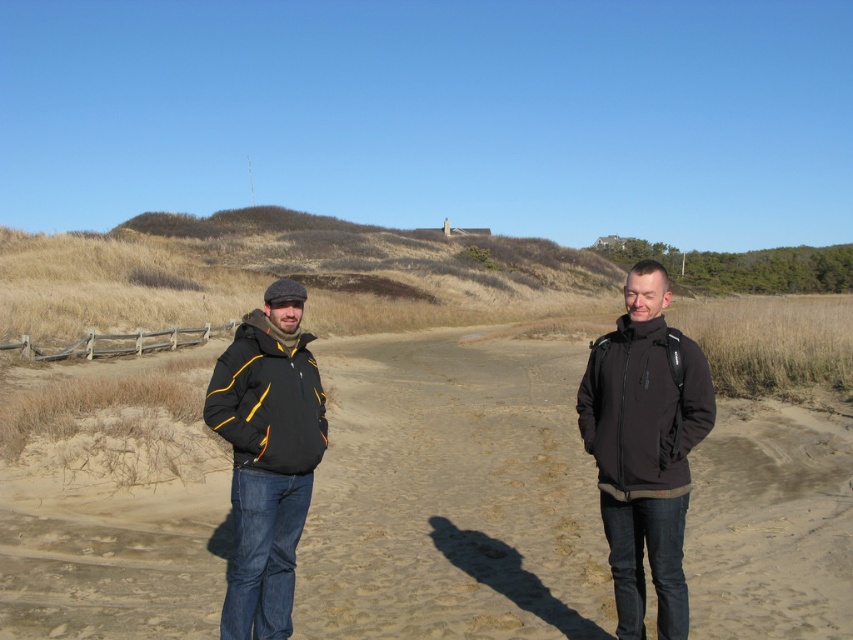
Question: Which of these objects is positioned farthest from the matte black jacket at left?

Choices:
 (A) black softshell jacket at center
 (B) dull brown dirt at center

Answer: (B)

Question: Is dull brown dirt at center smaller than black softshell jacket at center?

Choices:
 (A) no
 (B) yes

Answer: (A)

Question: Can you confirm if black softshell jacket at center is bigger than matte black jacket at left?

Choices:
 (A) yes
 (B) no

Answer: (B)

Question: Among these objects, which one is nearest to the camera?

Choices:
 (A) matte black jacket at left
 (B) black softshell jacket at center

Answer: (B)

Question: Is dull brown dirt at center smaller than black softshell jacket at center?

Choices:
 (A) no
 (B) yes

Answer: (A)

Question: Which point is closer to the camera?

Choices:
 (A) dull brown dirt at center
 (B) matte black jacket at left
 (C) black softshell jacket at center

Answer: (C)